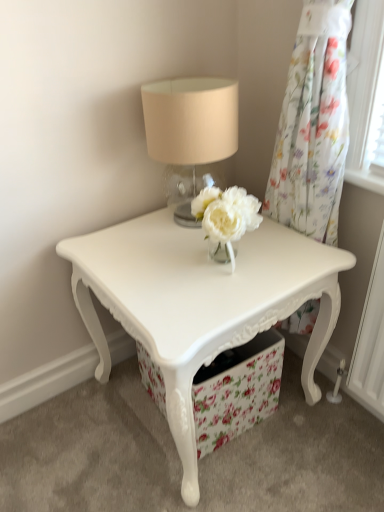
Question: Is point (130, 293) positioned closer to the camera than point (299, 96)?

Choices:
 (A) closer
 (B) farther

Answer: (A)

Question: From the image's perspective, is white glossy table at center above or below floral sheer curtain at upper right?

Choices:
 (A) below
 (B) above

Answer: (A)

Question: Based on their relative distances, which object is nearer to the matte glass table lamp at upper center?

Choices:
 (A) floral sheer curtain at upper right
 (B) floral fabric drawer at center
 (C) white glossy table at center

Answer: (A)

Question: Based on their relative distances, which object is nearer to the floral sheer curtain at upper right?

Choices:
 (A) matte glass table lamp at upper center
 (B) floral fabric drawer at center
 (C) white glossy table at center

Answer: (A)